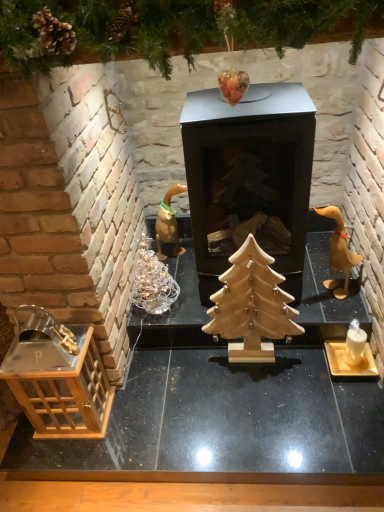
Question: Can you confirm if transparent glass lantern at lower left is positioned to the right of natural wood christmas tree at center?

Choices:
 (A) no
 (B) yes

Answer: (A)

Question: From the image's perspective, does transparent glass lantern at lower left appear lower than natural wood christmas tree at center?

Choices:
 (A) yes
 (B) no

Answer: (A)

Question: From a real-world perspective, is transparent glass lantern at lower left positioned under natural wood christmas tree at center based on gravity?

Choices:
 (A) no
 (B) yes

Answer: (B)

Question: Does transparent glass lantern at lower left lie behind natural wood christmas tree at center?

Choices:
 (A) no
 (B) yes

Answer: (A)

Question: Is transparent glass lantern at lower left oriented towards natural wood christmas tree at center?

Choices:
 (A) no
 (B) yes

Answer: (A)

Question: From a real-world perspective, is wooden christmas tree at upper center positioned above or below wooden table at lower left?

Choices:
 (A) below
 (B) above

Answer: (B)

Question: Considering the positions of wooden christmas tree at upper center and wooden table at lower left in the image, is wooden christmas tree at upper center bigger or smaller than wooden table at lower left?

Choices:
 (A) small
 (B) big

Answer: (A)

Question: Is wooden christmas tree at upper center to the left or to the right of wooden table at lower left in the image?

Choices:
 (A) left
 (B) right

Answer: (A)

Question: Relative to wooden table at lower left, is wooden christmas tree at upper center in front or behind?

Choices:
 (A) behind
 (B) front

Answer: (B)

Question: Is transparent glass lantern at lower left bigger or smaller than matte gold candle holder at lower right?

Choices:
 (A) small
 (B) big

Answer: (B)

Question: Based on their positions, is transparent glass lantern at lower left located to the left or right of matte gold candle holder at lower right?

Choices:
 (A) right
 (B) left

Answer: (B)

Question: Which is correct: transparent glass lantern at lower left is inside matte gold candle holder at lower right, or outside of it?

Choices:
 (A) inside
 (B) outside

Answer: (B)

Question: From the image's perspective, is transparent glass lantern at lower left located above or below matte gold candle holder at lower right?

Choices:
 (A) below
 (B) above

Answer: (A)

Question: Would you say wooden table at lower left is inside or outside matte gold candle holder at lower right?

Choices:
 (A) inside
 (B) outside

Answer: (B)

Question: Considering the positions of wooden table at lower left and matte gold candle holder at lower right in the image, is wooden table at lower left wider or thinner than matte gold candle holder at lower right?

Choices:
 (A) thin
 (B) wide

Answer: (B)